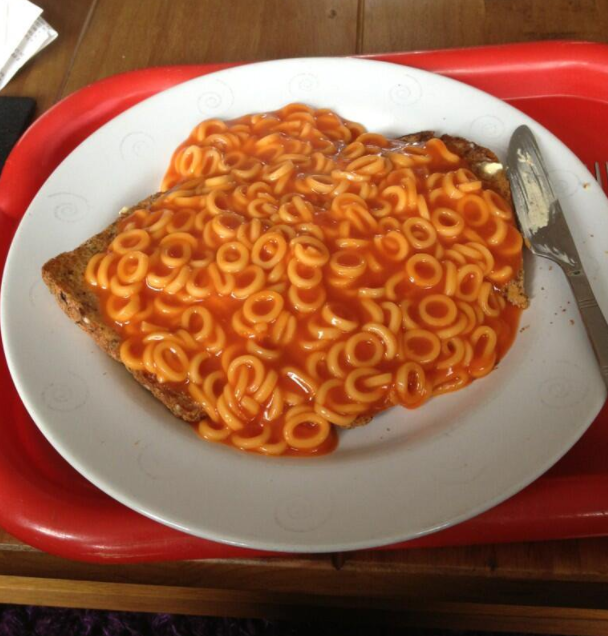
At what (x,y) coordinates should I click in order to perform the action: click on specular highlight on plastic tray. Please return your answer as a coordinate pair (x, y). Looking at the image, I should click on (50, 532).